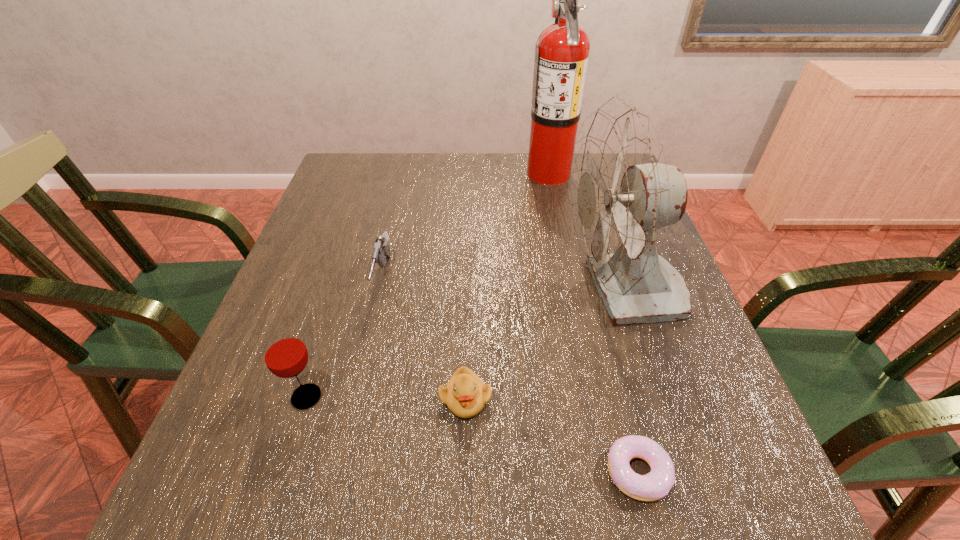
The image size is (960, 540). I want to click on fire extinguisher, so click(561, 57).

The height and width of the screenshot is (540, 960). I want to click on the farthest object, so click(561, 57).

Where is `fan`? This screenshot has height=540, width=960. fan is located at coordinates (623, 195).

Locate an element on the screen. Image resolution: width=960 pixels, height=540 pixels. glass is located at coordinates (285, 354).

Where is `the leftmost object`? the leftmost object is located at coordinates (285, 354).

Identify the location of the fourth tallest object. This screenshot has height=540, width=960. tap(381, 248).

Locate an element on the screen. The height and width of the screenshot is (540, 960). gun is located at coordinates (381, 248).

At what (x,y) coordinates should I click in order to perform the action: click on duckling. Please return your answer as a coordinate pair (x, y). This screenshot has width=960, height=540. Looking at the image, I should click on (465, 394).

Where is `the second shortest object`? the second shortest object is located at coordinates (465, 394).

Locate an element on the screen. The image size is (960, 540). doughnut is located at coordinates (655, 485).